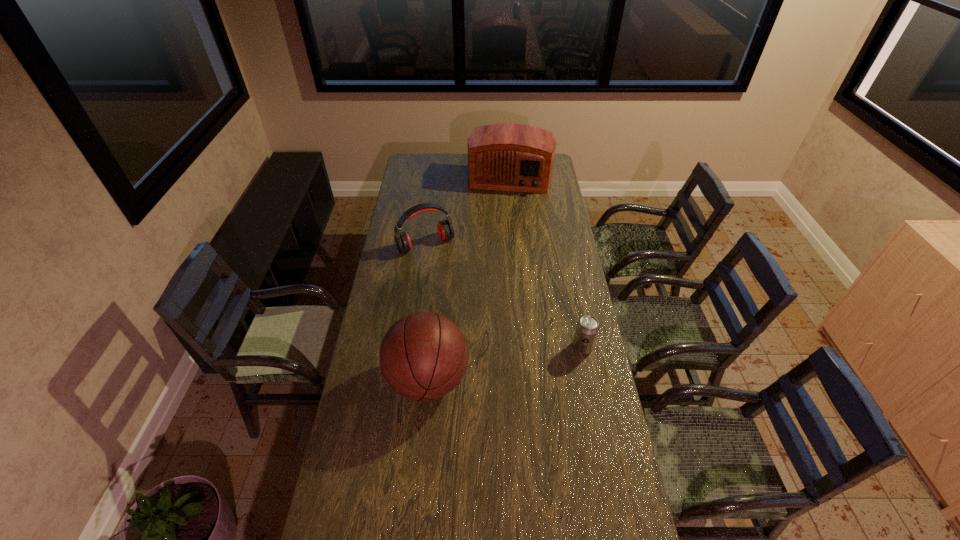
I want to click on object that stands as the second closest to the farthest object, so click(x=587, y=328).

The width and height of the screenshot is (960, 540). In order to click on the closest object to the beer can in this screenshot , I will do `click(423, 356)`.

Where is `free space that satisfies the following two spatial constraints: 1. on the back side of the shortest object; 2. on the right side of the basketball`? free space that satisfies the following two spatial constraints: 1. on the back side of the shortest object; 2. on the right side of the basketball is located at coordinates (431, 347).

Locate an element on the screen. The width and height of the screenshot is (960, 540). vacant region that satisfies the following two spatial constraints: 1. on the back side of the farthest object; 2. on the right side of the basketball is located at coordinates (447, 176).

At what (x,y) coordinates should I click in order to perform the action: click on free location that satisfies the following two spatial constraints: 1. on the front side of the shortest object; 2. on the left side of the radio receiver. Please return your answer as a coordinate pair (x, y). The image size is (960, 540). Looking at the image, I should click on (524, 347).

Where is `free space that satisfies the following two spatial constraints: 1. on the front side of the basketball; 2. on the right side of the second shortest object`? free space that satisfies the following two spatial constraints: 1. on the front side of the basketball; 2. on the right side of the second shortest object is located at coordinates (407, 380).

Where is `blank space that satisfies the following two spatial constraints: 1. on the back side of the basketball; 2. on the right side of the shortest object`? The height and width of the screenshot is (540, 960). blank space that satisfies the following two spatial constraints: 1. on the back side of the basketball; 2. on the right side of the shortest object is located at coordinates (431, 347).